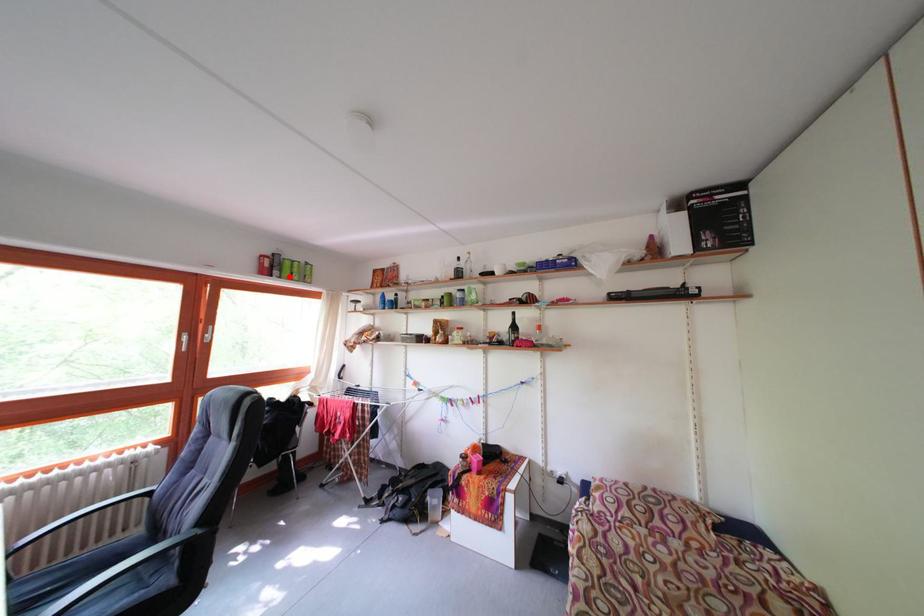
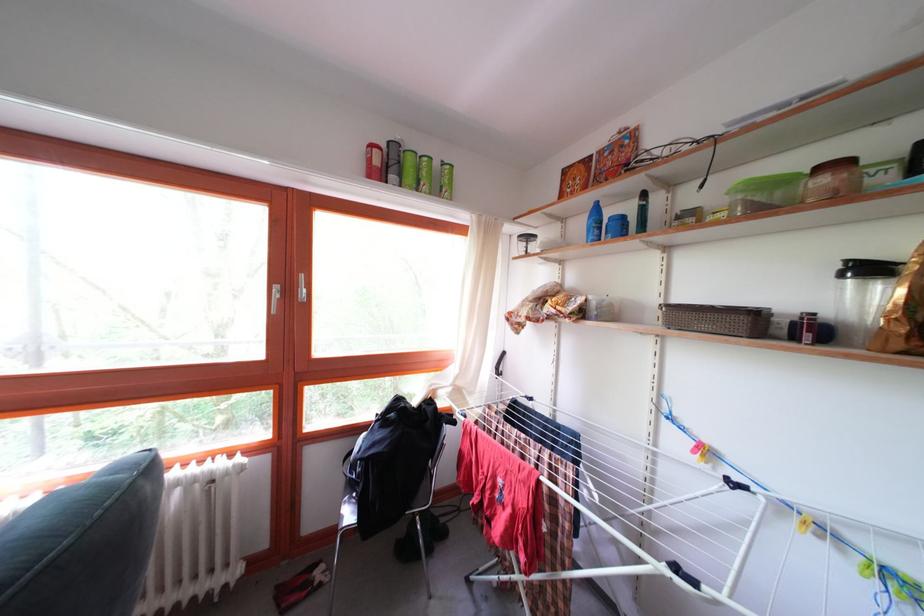
Find the pixel in the second image that matches the highlighted location in the first image.

(409, 180)